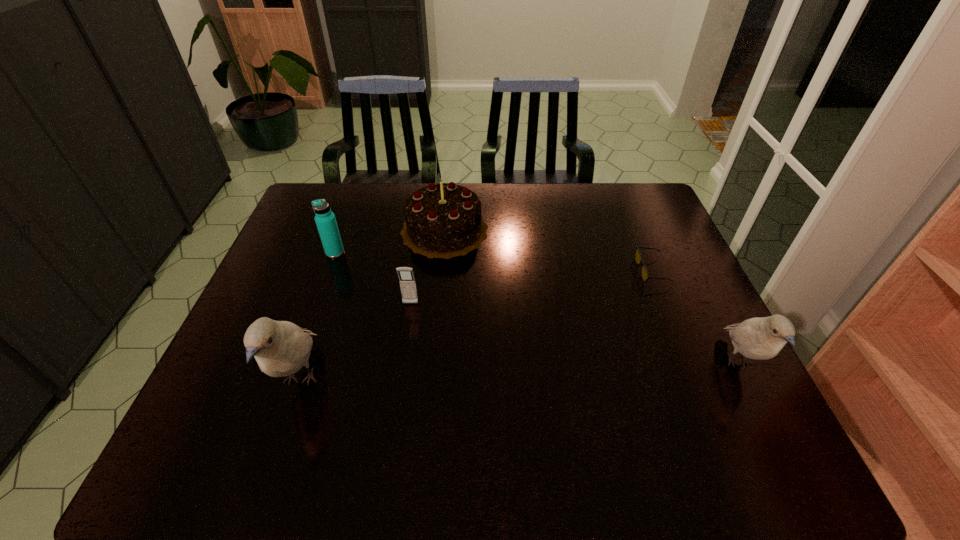
Locate an element on the screen. This screenshot has width=960, height=540. sunglasses positioned at the right edge is located at coordinates (638, 258).

Find the location of a particular element. The image size is (960, 540). object that is at the near left corner is located at coordinates (281, 348).

The height and width of the screenshot is (540, 960). Find the location of `object positioned at the near right corner`. object positioned at the near right corner is located at coordinates (761, 338).

The width and height of the screenshot is (960, 540). In the image, there is a desktop. Find the location of `free space at the far edge`. free space at the far edge is located at coordinates (483, 201).

Image resolution: width=960 pixels, height=540 pixels. What are the coordinates of `free region at the near edge of the desktop` in the screenshot? It's located at (296, 406).

You are a GUI agent. You are given a task and a screenshot of the screen. Output one action in this format:
    pyautogui.click(x=<x>, y=<y>)
    Task: Click on the vacant space at the left edge of the desktop
    Image resolution: width=960 pixels, height=540 pixels.
    Given the screenshot: What is the action you would take?
    pyautogui.click(x=301, y=236)

Where is `free region at the right edge`? This screenshot has width=960, height=540. free region at the right edge is located at coordinates (683, 362).

I want to click on vacant space in between the shorter bird and the sunglasses, so click(695, 317).

Locate an element on the screen. Image resolution: width=960 pixels, height=540 pixels. free space between the water bottle and the right bird is located at coordinates (537, 308).

I want to click on free spot between the second shortest object and the rightmost object, so click(x=575, y=334).